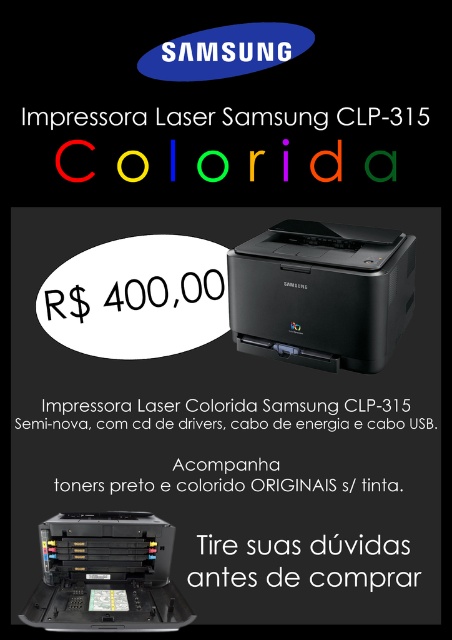
Looking at this image, you are designing a layout for a poster and want to place a sticker exactly at the point marked as point [106,573]. Based on the image description, where would this sticker be placed?

The point [106,573] is located on the matte black printer at lower center, so placing the sticker there would position it directly on the printer in the lower central area of the poster.

You are standing in a room and want to print a document using the matte black printer at center. If you are currently 10 feet away from it, will you need to walk more than 5 feet to reach it?

The matte black printer at center is 4.50 feet away from viewer, so no, you don not need to walk more than 5 feet to reach it since the distance is less than 5 feet.